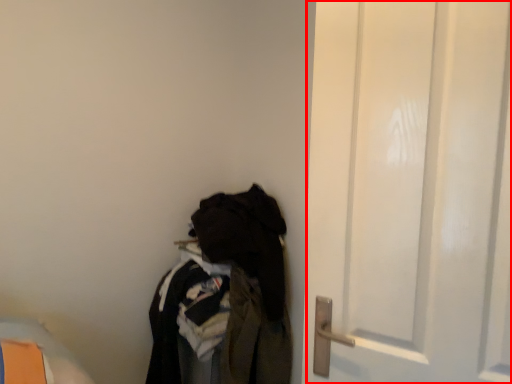
Question: From the image's perspective, what is the correct spatial relationship of door (annotated by the red box) in relation to closet?

Choices:
 (A) above
 (B) below

Answer: (A)